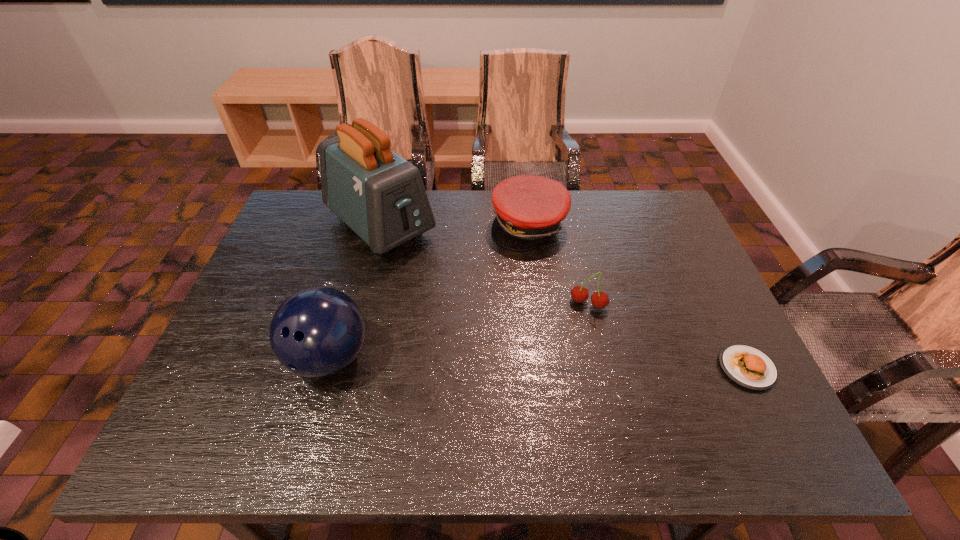
Locate an element on the screen. The height and width of the screenshot is (540, 960). object that is at the left edge is located at coordinates (379, 195).

You are a GUI agent. You are given a task and a screenshot of the screen. Output one action in this format:
    pyautogui.click(x=<x>, y=<y>)
    Task: Click on the object present at the right edge
    
    Given the screenshot: What is the action you would take?
    pyautogui.click(x=746, y=366)

Find the location of `object that is at the far left corner`. object that is at the far left corner is located at coordinates click(x=379, y=195).

Identify the location of object that is at the near right corner. The width and height of the screenshot is (960, 540). (746, 366).

Where is `vacant space at the near edge of the desktop`? vacant space at the near edge of the desktop is located at coordinates pyautogui.click(x=394, y=409).

In the image, there is a desktop. Find the location of `vacant space at the left edge`. vacant space at the left edge is located at coordinates (229, 341).

The width and height of the screenshot is (960, 540). Identify the location of vacant space at the right edge of the desktop. (701, 295).

The width and height of the screenshot is (960, 540). Find the location of `vacant region at the far left corner`. vacant region at the far left corner is located at coordinates (314, 225).

Where is `vacant point at the near left corner`? The image size is (960, 540). vacant point at the near left corner is located at coordinates (240, 382).

I want to click on free space that is in between the food and the cherry, so click(667, 336).